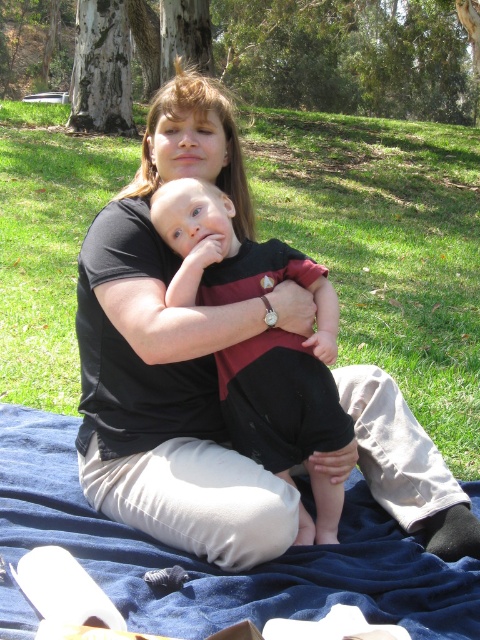
Question: Considering the real-world distances, which object is closest to the green grass at center?

Choices:
 (A) blue fabric blanket at lower center
 (B) matte black baby at center

Answer: (B)

Question: Among these points, which one is nearest to the camera?

Choices:
 (A) (0, 600)
 (B) (350, 150)

Answer: (A)

Question: Which object is farther from the camera taking this photo?

Choices:
 (A) blue fabric blanket at lower center
 (B) matte black baby at center
 (C) green grass at center

Answer: (C)

Question: Does green grass at center have a greater width compared to blue fabric blanket at lower center?

Choices:
 (A) no
 (B) yes

Answer: (B)

Question: Does green grass at center have a greater width compared to matte black baby at center?

Choices:
 (A) no
 (B) yes

Answer: (B)

Question: Does blue fabric blanket at lower center appear over matte black baby at center?

Choices:
 (A) no
 (B) yes

Answer: (A)